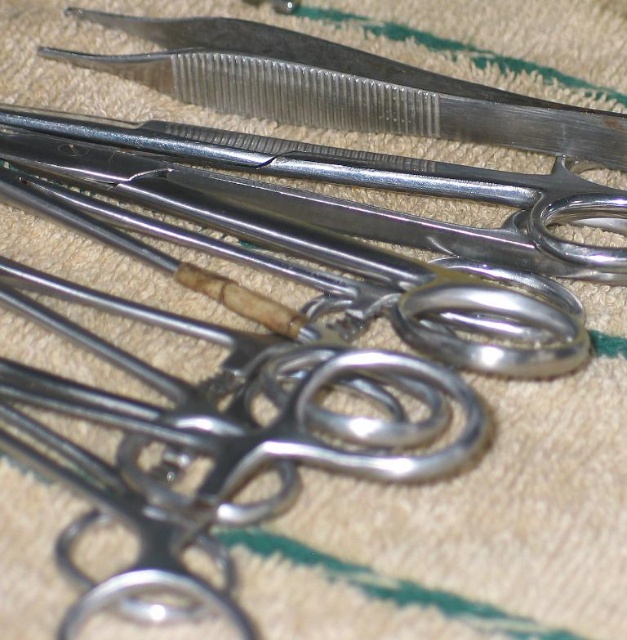
Which is behind, point (263, 147) or point (350, 116)?

Positioned behind is point (350, 116).

Between point (55, 122) and point (399, 106), which one is positioned behind?

The point (399, 106) is more distant.

Find the location of a particular element. polished metal scissors at center is located at coordinates (357, 186).